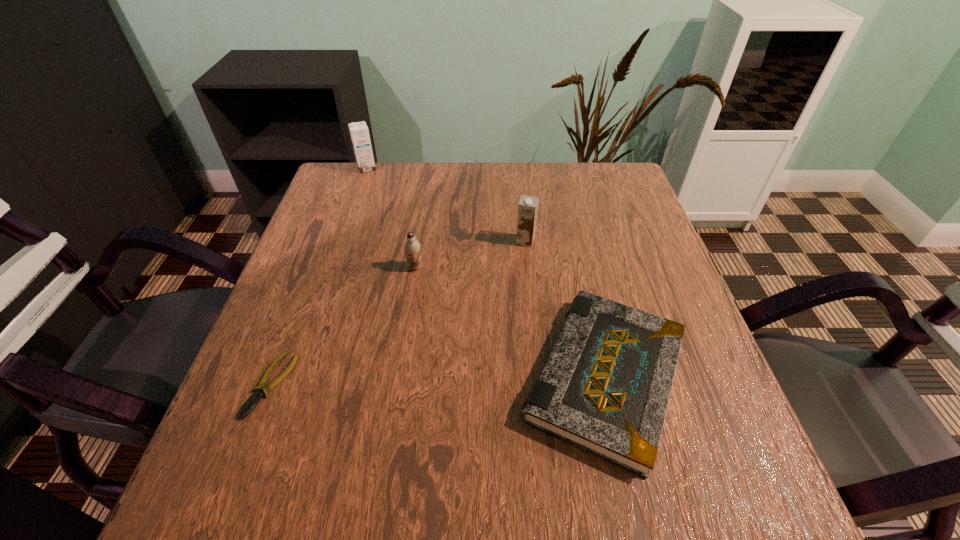
Locate an element on the screen. the second closest chocolate milk to the third shortest object is located at coordinates (359, 132).

The height and width of the screenshot is (540, 960). Find the location of `blank area in the image that satisfies the following two spatial constraints: 1. on the front side of the second shortest object; 2. on the right side of the farthest object`. blank area in the image that satisfies the following two spatial constraints: 1. on the front side of the second shortest object; 2. on the right side of the farthest object is located at coordinates (295, 377).

What are the coordinates of `vacant region that satisfies the following two spatial constraints: 1. on the front side of the third object from right to left; 2. on the left side of the farthest chocolate milk` in the screenshot? It's located at (333, 267).